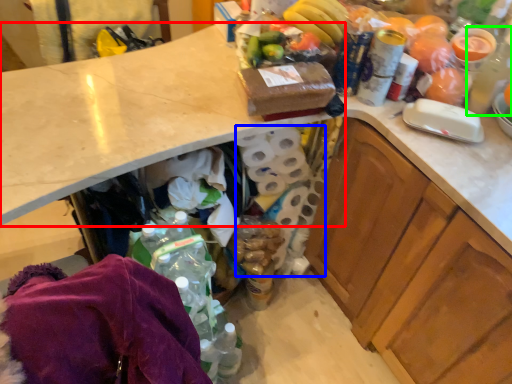
Question: Which object is the farthest from countertop (highlighted by a red box)? Choose among these: toilet paper (highlighted by a blue box) or bottle (highlighted by a green box).

Choices:
 (A) toilet paper
 (B) bottle

Answer: (B)